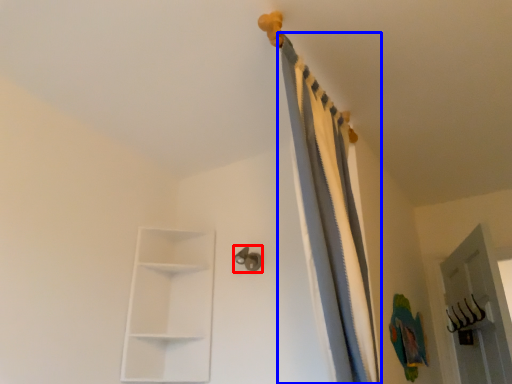
Question: Which object is further to the camera taking this photo, door handle (highlighted by a red box) or curtain (highlighted by a blue box)?

Choices:
 (A) door handle
 (B) curtain

Answer: (A)